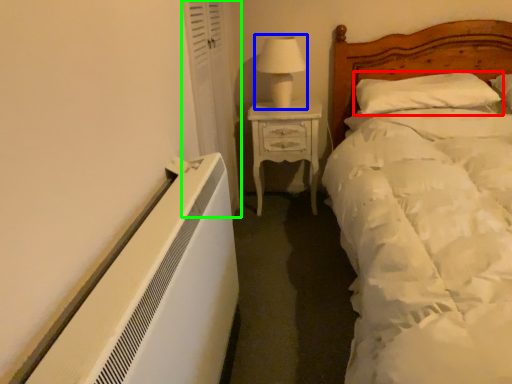
Question: Considering the real-world distances, which object is closest to pillow (highlighted by a red box)? table lamp (highlighted by a blue box) or curtain (highlighted by a green box).

Choices:
 (A) table lamp
 (B) curtain

Answer: (A)